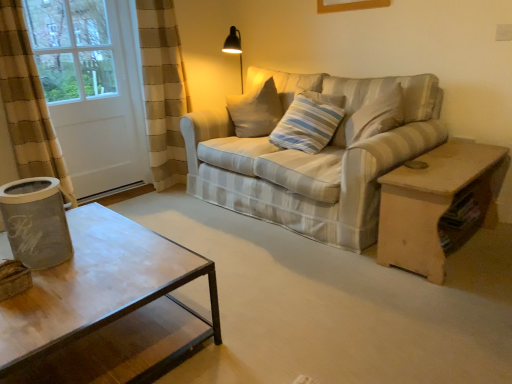
At what (x,y) coordinates should I click in order to perform the action: click on free location to the left of light brown wooden table at right. Please return your answer as a coordinate pair (x, y). Looking at the image, I should click on (327, 282).